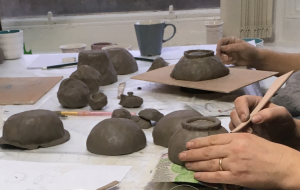
Identify the location of wall. The image size is (300, 190). (187, 28).